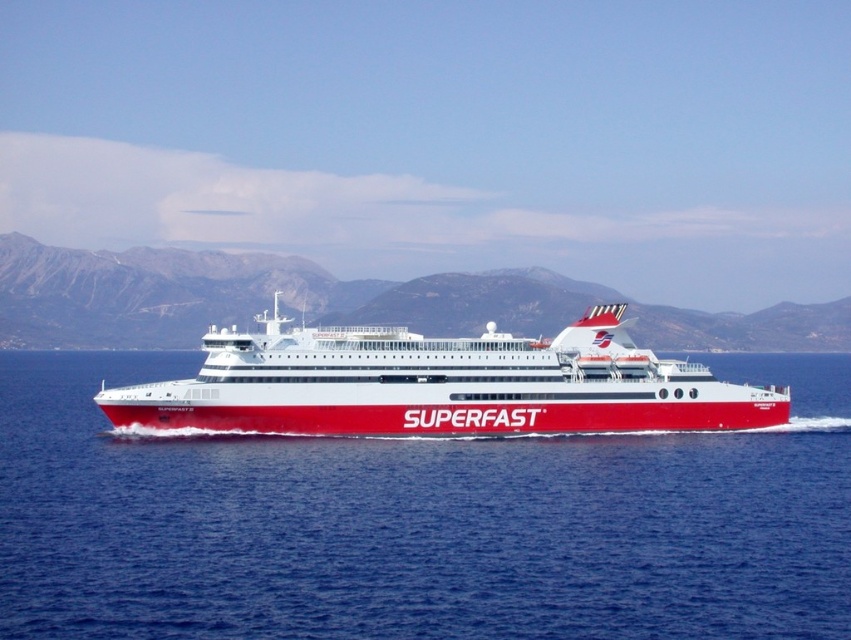
Question: Does red glossy water at center appear on the right side of gray rocky mountain at center?

Choices:
 (A) no
 (B) yes

Answer: (B)

Question: Which point is farther to the camera?

Choices:
 (A) (714, 394)
 (B) (134, 289)
 (C) (393, 442)

Answer: (B)

Question: Does white glossy cruise ship at center appear on the right side of gray rocky mountain at center?

Choices:
 (A) no
 (B) yes

Answer: (B)

Question: Can you confirm if red glossy water at center is bigger than gray rocky mountain at center?

Choices:
 (A) no
 (B) yes

Answer: (A)

Question: Considering the real-world distances, which object is farthest from the red glossy water at center?

Choices:
 (A) white glossy cruise ship at center
 (B) gray rocky mountain at center

Answer: (B)

Question: Among these points, which one is nearest to the camera?

Choices:
 (A) (41, 346)
 (B) (507, 380)
 (C) (398, 449)

Answer: (C)